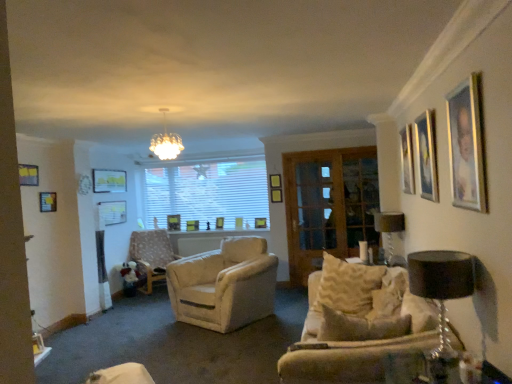
Describe the element at coordinates (174, 222) in the screenshot. This screenshot has height=384, width=512. I see `wooden picture frame at center, the eighth picture frame when ordered from right to left` at that location.

In order to face matte black lampshade at right, acting as the first lamp starting from the right, should I rotate leftwards or rightwards?

You should look right and rotate roughly 17.431 degrees.

What do you see at coordinates (239, 223) in the screenshot? I see `wooden picture frame at center, placed as the eighth picture frame when sorted from left to right` at bounding box center [239, 223].

Where is `wooden picture frame at center, which is counted as the 7th picture frame, starting from the front`? This screenshot has height=384, width=512. wooden picture frame at center, which is counted as the 7th picture frame, starting from the front is located at coordinates (112, 213).

Locate an element on the screen. The image size is (512, 384). wooden picture frame at upper left, arranged as the ninth picture frame when viewed from the back is located at coordinates (28, 175).

The width and height of the screenshot is (512, 384). Identify the location of wooden picture frame at center, the eighth picture frame when ordered from right to left. (174, 222).

Is wooden picture frame at center, which is the 3th picture frame from back to front, not close to wooden picture frame at upper right, which is the twelfth picture frame from left to right?

wooden picture frame at center, which is the 3th picture frame from back to front, is far away from wooden picture frame at upper right, which is the twelfth picture frame from left to right.

Find the location of a particular element. This screenshot has width=512, height=384. the 5th picture frame counting from the right side of the wooden picture frame at center, which is the 3th picture frame from back to front is located at coordinates (407, 160).

Between wooden picture frame at center, the 7th picture frame viewed from the left, and wooden picture frame at upper right, which is the twelfth picture frame from left to right, which one has less height?

wooden picture frame at center, the 7th picture frame viewed from the left, is shorter.

From a real-world perspective, who is located higher, matte black lampshade at right, acting as the first lamp starting from the right, or white textured blinds at center?

white textured blinds at center, from a real-world perspective.

Is matte black lampshade at right, acting as the first lamp starting from the right, facing away from white textured blinds at center?

No, white textured blinds at center is not at the back of matte black lampshade at right, acting as the first lamp starting from the right.

Are matte black lampshade at right, the 2th lamp viewed from the front, and white textured blinds at center making contact?

No, matte black lampshade at right, the 2th lamp viewed from the front, is not making contact with white textured blinds at center.

Find the location of a particular element. Image resolution: width=512 pixels, height=384 pixels. the 2nd lamp to the right of the white textured blinds at center, starting your count from the anchor is located at coordinates (389, 229).

Does point (379, 308) come in front of point (32, 176)?

Yes, it is.

Which of these two, beige fabric pillow at lower right, which is the 2th pillow from back to front, or wooden picture frame at upper left, arranged as the ninth picture frame when viewed from the back, is thinner?

With smaller width is wooden picture frame at upper left, arranged as the ninth picture frame when viewed from the back.

Between beige fabric pillow at lower right, which is the 2th pillow from back to front, and wooden picture frame at upper left, acting as the first picture frame starting from the left, which one has more height?

With more height is beige fabric pillow at lower right, which is the 2th pillow from back to front.

Is wooden picture frame at center, which ranks as the fourth picture frame in back-to-front order, not close to matte gold picture frame at upper right, which appears as the eleventh picture frame when viewed from the left?

Yes, wooden picture frame at center, which ranks as the fourth picture frame in back-to-front order, and matte gold picture frame at upper right, which appears as the eleventh picture frame when viewed from the left, are located far from each other.

At what (x,y) coordinates should I click in order to perform the action: click on the 6th picture frame directly above the wooden picture frame at center, the 5th picture frame viewed from the right (from a real-world perspective). Please return your answer as a coordinate pair (x, y). The width and height of the screenshot is (512, 384). Looking at the image, I should click on (426, 155).

Which point is more forward, (234, 218) or (430, 142)?

Point (430, 142)

Which object is positioned more to the right, wooden picture frame at center, which ranks as the fourth picture frame in back-to-front order, or matte gold picture frame at upper right, which is counted as the eleventh picture frame, starting from the back?

Positioned to the right is matte gold picture frame at upper right, which is counted as the eleventh picture frame, starting from the back.

Considering the relative sizes of wooden picture frame at center, the eighth picture frame viewed from the front, and wooden screen door at center in the image provided, is wooden picture frame at center, the eighth picture frame viewed from the front, smaller than wooden screen door at center?

Indeed, wooden picture frame at center, the eighth picture frame viewed from the front, has a smaller size compared to wooden screen door at center.

Who is more distant, wooden picture frame at center, which appears as the fourth picture frame when viewed from the right, or wooden screen door at center?

wooden picture frame at center, which appears as the fourth picture frame when viewed from the right, is further away from the camera.

Can you confirm if wooden picture frame at center, marked as the fifth picture frame in a back-to-front arrangement, is thinner than wooden screen door at center?

In fact, wooden picture frame at center, marked as the fifth picture frame in a back-to-front arrangement, might be wider than wooden screen door at center.

Is matte black lampshade at right, the 2th lamp viewed from the front, positioned with its back to matte gold picture frame at upper right, which appears as the eleventh picture frame when viewed from the left?

No.

Is matte black lampshade at right, the first lamp in the back-to-front sequence, located outside matte gold picture frame at upper right, placed as the 2th picture frame when sorted from front to back?

Yes.

Between matte black lampshade at right, the second lamp positioned from the left, and matte gold picture frame at upper right, the second picture frame in the right-to-left sequence, which one is positioned behind?

Positioned behind is matte black lampshade at right, the second lamp positioned from the left.

From the image's perspective, which object appears higher, matte black lampshade at right, acting as the first lamp starting from the right, or matte gold picture frame at upper right, the second picture frame in the right-to-left sequence?

From the image's view, matte gold picture frame at upper right, the second picture frame in the right-to-left sequence, is above.

How much distance is there between patterned fabric chair at center-left and matte white picture frame at upper left, the 3th picture frame positioned from the left?

patterned fabric chair at center-left and matte white picture frame at upper left, the 3th picture frame positioned from the left, are 3.66 feet apart from each other.

Looking at this image, are patterned fabric chair at center-left and matte white picture frame at upper left, the tenth picture frame viewed from the right, making contact?

No, patterned fabric chair at center-left is not touching matte white picture frame at upper left, the tenth picture frame viewed from the right.

Is patterned fabric chair at center-left turned away from matte white picture frame at upper left, the 7th picture frame positioned from the back?

That's not correct — patterned fabric chair at center-left is not looking away from matte white picture frame at upper left, the 7th picture frame positioned from the back.

In the scene shown: Considering the sizes of objects patterned fabric chair at center-left and matte white picture frame at upper left, the tenth picture frame viewed from the right, in the image provided, who is wider, patterned fabric chair at center-left or matte white picture frame at upper left, the tenth picture frame viewed from the right,?

With larger width is patterned fabric chair at center-left.

Image resolution: width=512 pixels, height=384 pixels. What are the coordinates of `the 5th picture frame counting from the right side of the wooden picture frame at center, which is the 3th picture frame from back to front` in the screenshot? It's located at (407, 160).

You are a GUI agent. You are given a task and a screenshot of the screen. Output one action in this format:
    pyautogui.click(x=<x>, y=<y>)
    Task: Click on the window that is above the matte black lampshade at right, acting as the first lamp starting from the right (from a real-world perspective)
    The width and height of the screenshot is (512, 384).
    Given the screenshot: What is the action you would take?
    pyautogui.click(x=206, y=190)

Estimate the real-world distances between objects in this image. Which object is closer to matte black lampshade at right, the second lamp positioned from the left, white textured blinds at center or wooden picture frame at center, the eighth picture frame viewed from the front?

wooden picture frame at center, the eighth picture frame viewed from the front, is closer to matte black lampshade at right, the second lamp positioned from the left.

Considering their positions, is wooden picture frame at center, the 5th picture frame viewed from the right, positioned closer to wooden picture frame at center, which appears as the 6th picture frame when viewed from the right, than wooden picture frame at left, which is counted as the 11th picture frame, starting from the right?

wooden picture frame at center, the 5th picture frame viewed from the right.

From the picture: Which object lies further to the anchor point beige fabric pillow at lower right, which is the 2th pillow from back to front, patterned fabric chair at center-left or wooden picture frame at center, which ranks as the 7th picture frame in right-to-left order?

wooden picture frame at center, which ranks as the 7th picture frame in right-to-left order.

Considering their positions, is wooden picture frame at center, placed as the eighth picture frame when sorted from left to right, positioned closer to wooden picture frame at center, marked as the fifth picture frame in a back-to-front arrangement, than patterned fabric chair at center-left?

wooden picture frame at center, placed as the eighth picture frame when sorted from left to right, is positioned closer to the anchor wooden picture frame at center, marked as the fifth picture frame in a back-to-front arrangement.

Estimate the real-world distances between objects in this image. Which object is closer to black fabric lampshade at right, which is the first lamp from left to right, white glass chandelier at upper center or patterned fabric chair at center-left?

white glass chandelier at upper center lies closer to black fabric lampshade at right, which is the first lamp from left to right, than the other object.

Based on their spatial positions, is matte black lampshade at right, acting as the first lamp starting from the right, or patterned fabric chair at center-left further from matte gold picture frame at upper right, placed as the 2th picture frame when sorted from front to back?

patterned fabric chair at center-left.

Looking at the image, which one is located closer to wooden picture frame at left, which ranks as the 8th picture frame in back-to-front order, wooden picture frame at center, which ranks as the fourth picture frame in back-to-front order, or beige textured pillow at center, the 2th pillow when ordered from front to back?

wooden picture frame at center, which ranks as the fourth picture frame in back-to-front order, is closer to wooden picture frame at left, which ranks as the 8th picture frame in back-to-front order.

Which object lies further to the anchor point matte white picture frame at upper left, the 3th picture frame positioned from the left, matte gold picture frame at upper right, the second picture frame in the right-to-left sequence, or wooden picture frame at center, the eighth picture frame when ordered from right to left?

matte gold picture frame at upper right, the second picture frame in the right-to-left sequence, lies further to matte white picture frame at upper left, the 3th picture frame positioned from the left, than the other object.

Locate an element on the screen. The height and width of the screenshot is (384, 512). chair between wooden picture frame at left, which is the 5th picture frame in front-to-back order, and white textured blinds at center in the front-back direction is located at coordinates (151, 255).

Locate an element on the screen. This screenshot has width=512, height=384. light fixture between wooden picture frame at center, which is counted as the 7th picture frame, starting from the front, and matte black lampshade at right, the 2th lamp viewed from the front, in the horizontal direction is located at coordinates (166, 142).

Locate an element on the screen. This screenshot has width=512, height=384. window between wooden picture frame at upper left, acting as the first picture frame starting from the left, and wooden picture frame at center, the 11th picture frame positioned from the front, from front to back is located at coordinates (206, 190).

Identify the location of pillow between beige fabric pillow at lower right, which is the 2th pillow from back to front, and patterned fabric chair at center-left in the front-back direction. The image size is (512, 384). click(x=347, y=286).